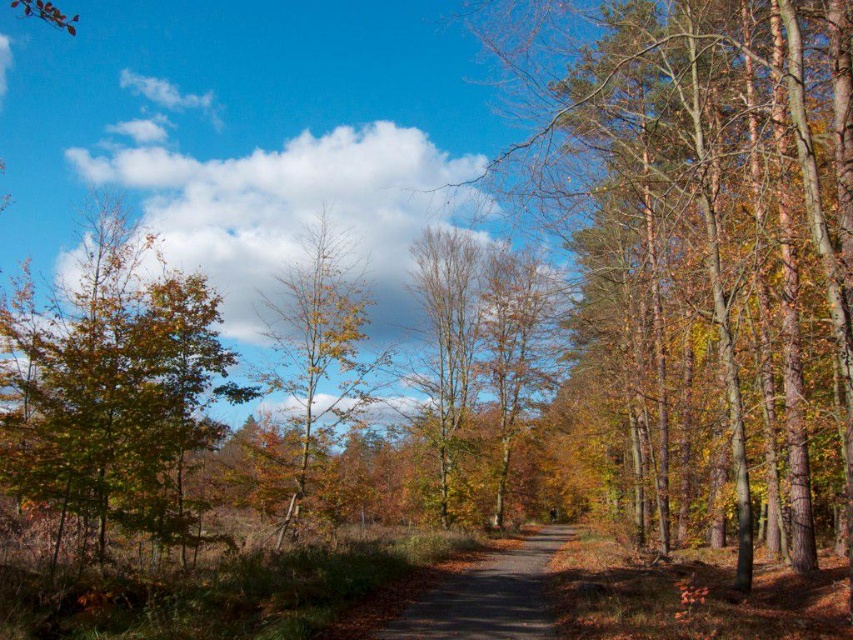
Question: Can you confirm if smooth bark tree at center is thinner than brown smooth tree at center?

Choices:
 (A) yes
 (B) no

Answer: (B)

Question: Which object is closer to the camera taking this photo?

Choices:
 (A) smooth bark tree at center
 (B) brown smooth tree at center
 (C) green matte tree at left
 (D) brown asphalt path at center

Answer: (A)

Question: Among these points, which one is nearest to the camera?

Choices:
 (A) (724, 285)
 (B) (410, 374)

Answer: (A)

Question: Among these objects, which one is farthest from the camera?

Choices:
 (A) green matte tree at center
 (B) brown asphalt path at center
 (C) brown smooth tree at center
 (D) smooth bark tree at center

Answer: (C)

Question: Can you confirm if green matte tree at center is wider than brown asphalt path at center?

Choices:
 (A) no
 (B) yes

Answer: (A)

Question: Is smooth bark tree at center to the right of brown smooth tree at center from the viewer's perspective?

Choices:
 (A) no
 (B) yes

Answer: (B)